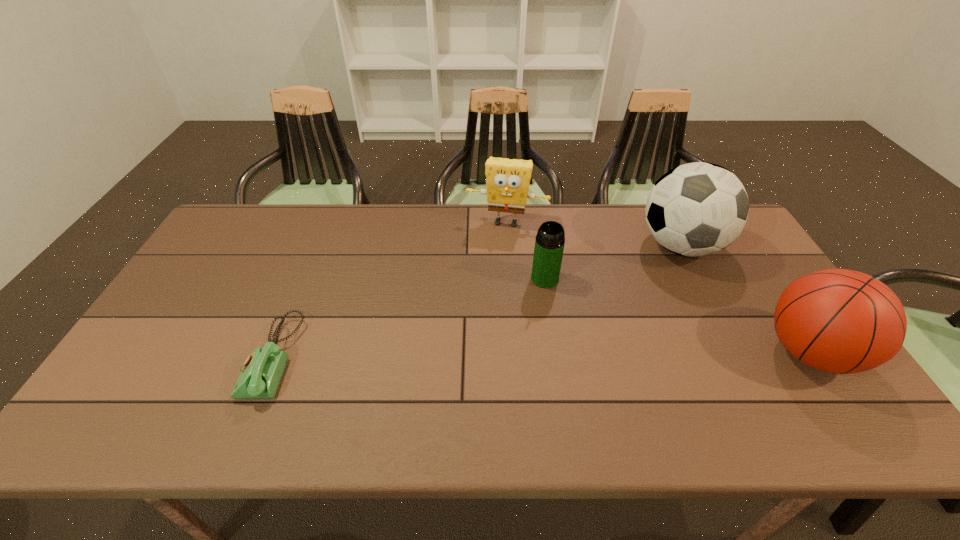
Where is `free spot between the soccer ball and the telephone`? The width and height of the screenshot is (960, 540). free spot between the soccer ball and the telephone is located at coordinates (477, 302).

Select which object appears as the second closest to the thermos bottle. Please provide its 2D coordinates. Your answer should be formatted as a tuple, i.e. [(x, y)], where the tuple contains the x and y coordinates of a point satisfying the conditions above.

[(696, 209)]

Point out which object is positioned as the nearest to the soccer ball. Please provide its 2D coordinates. Your answer should be formatted as a tuple, i.e. [(x, y)], where the tuple contains the x and y coordinates of a point satisfying the conditions above.

[(840, 321)]

Image resolution: width=960 pixels, height=540 pixels. Find the location of `vacant space that satisfies the following two spatial constraints: 1. on the front side of the soccer ball; 2. on the right side of the basketball`. vacant space that satisfies the following two spatial constraints: 1. on the front side of the soccer ball; 2. on the right side of the basketball is located at coordinates 734,353.